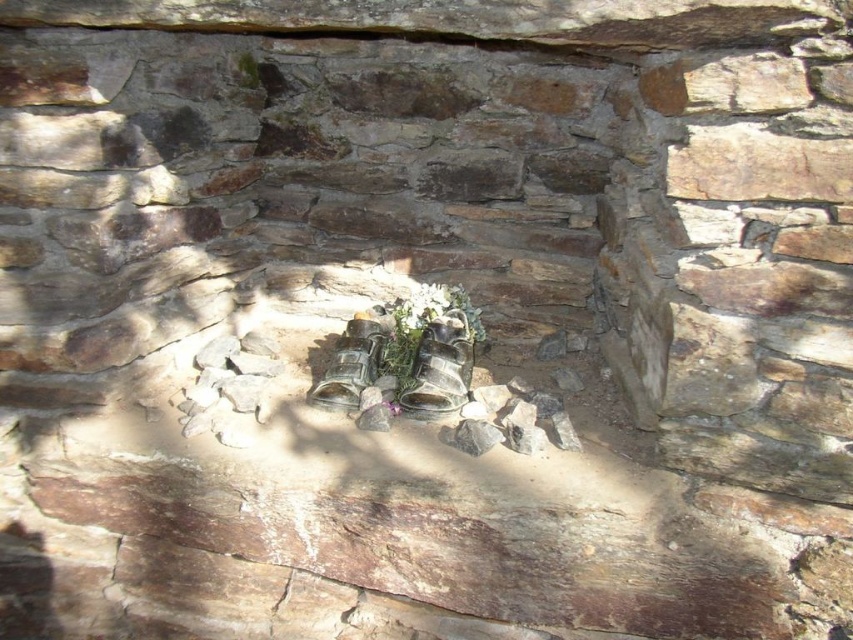
Question: Can you confirm if white matte floral arrangement at center is positioned below white matte flowers at center?

Choices:
 (A) no
 (B) yes

Answer: (B)

Question: Based on their relative distances, which object is nearer to the white matte flower at center?

Choices:
 (A) white matte flowers at center
 (B) white matte floral arrangement at center

Answer: (A)

Question: Is white matte floral arrangement at center to the left of white matte flower at center from the viewer's perspective?

Choices:
 (A) no
 (B) yes

Answer: (A)

Question: Which object appears closest to the camera in this image?

Choices:
 (A) white matte flowers at center
 (B) white matte floral arrangement at center
 (C) white matte flower at center

Answer: (B)

Question: Which of the following is the farthest from the observer?

Choices:
 (A) (392, 332)
 (B) (433, 291)
 (C) (428, 285)

Answer: (C)

Question: Is white matte flowers at center to the right of white matte flower at center from the viewer's perspective?

Choices:
 (A) no
 (B) yes

Answer: (B)